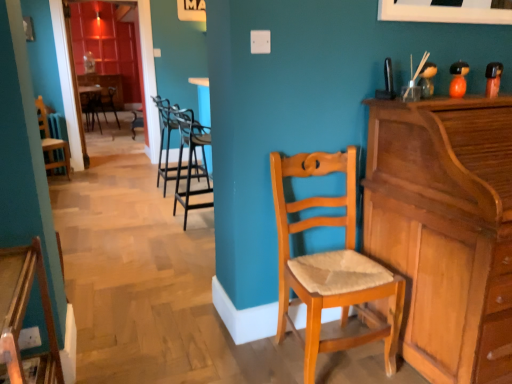
Question: Is light brown wooden chair at center, acting as the 6th chair starting from the left, facing towards light brown wood piano at right?

Choices:
 (A) yes
 (B) no

Answer: (B)

Question: Does light brown wooden chair at center, the fifth chair positioned from the back, have a smaller size compared to light brown wood piano at right?

Choices:
 (A) no
 (B) yes

Answer: (B)

Question: Is light brown wooden chair at center, the first chair positioned from the right, shorter than light brown wood piano at right?

Choices:
 (A) no
 (B) yes

Answer: (B)

Question: Can you confirm if light brown wooden chair at center, the fifth chair positioned from the back, is bigger than light brown wood piano at right?

Choices:
 (A) yes
 (B) no

Answer: (B)

Question: From a real-world perspective, is light brown wooden chair at center, which is the second chair in front-to-back order, positioned under light brown wood piano at right based on gravity?

Choices:
 (A) no
 (B) yes

Answer: (B)

Question: Is point pos(179,175) closer or farther from the camera than point pos(15,331)?

Choices:
 (A) farther
 (B) closer

Answer: (A)

Question: In the image, is black metal barstools at center, marked as the 2th chair in a right-to-left arrangement, on the left side or the right side of wooden chair with cushion at lower left, positioned as the fourth chair in left-to-right order?

Choices:
 (A) left
 (B) right

Answer: (B)

Question: Is black metal barstools at center, which appears as the fourth chair when viewed from the back, inside or outside of wooden chair with cushion at lower left, the 3th chair viewed from the right?

Choices:
 (A) inside
 (B) outside

Answer: (B)

Question: From the image's perspective, is black metal barstools at center, marked as the 2th chair in a right-to-left arrangement, located above or below wooden chair with cushion at lower left, the 3th chair viewed from the right?

Choices:
 (A) below
 (B) above

Answer: (B)

Question: Relative to black metal barstools at center, which is the third chair from back to front, is wooden chair with cushion at lower left, the 3th chair viewed from the right, in front or behind?

Choices:
 (A) behind
 (B) front

Answer: (B)

Question: From the image's perspective, is wooden chair with cushion at lower left, the 3th chair viewed from the right, positioned above or below black metal barstools at center, positioned as the third chair in left-to-right order?

Choices:
 (A) below
 (B) above

Answer: (A)

Question: Is wooden chair with cushion at lower left, arranged as the first chair when viewed from the front, inside the boundaries of black metal barstools at center, the fourth chair viewed from the front, or outside?

Choices:
 (A) inside
 (B) outside

Answer: (B)

Question: Considering the relative positions of wooden chair with cushion at lower left, positioned as the fourth chair in left-to-right order, and black metal barstools at center, which is the third chair from back to front, in the image provided, is wooden chair with cushion at lower left, positioned as the fourth chair in left-to-right order, to the left or to the right of black metal barstools at center, which is the third chair from back to front,?

Choices:
 (A) left
 (B) right

Answer: (B)

Question: Considering the positions of light brown wood piano at right and black metal barstools at center, the 5th chair from the left, in the image, is light brown wood piano at right taller or shorter than black metal barstools at center, the 5th chair from the left,?

Choices:
 (A) tall
 (B) short

Answer: (A)

Question: From a real-world perspective, is light brown wood piano at right above or below black metal barstools at center, marked as the 2th chair in a right-to-left arrangement?

Choices:
 (A) above
 (B) below

Answer: (A)